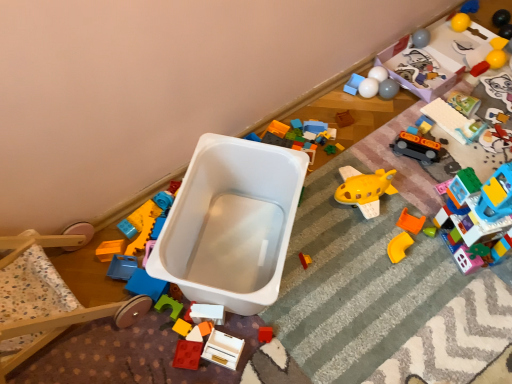
Where is `vacant area that lies between matte yellow toy airplane at center, placed as the 12th toy when sorted from right to left, and translucent plastic building blocks at right, positioned as the 12th toy in left-to-right order`? This screenshot has height=384, width=512. vacant area that lies between matte yellow toy airplane at center, placed as the 12th toy when sorted from right to left, and translucent plastic building blocks at right, positioned as the 12th toy in left-to-right order is located at coordinates (388, 251).